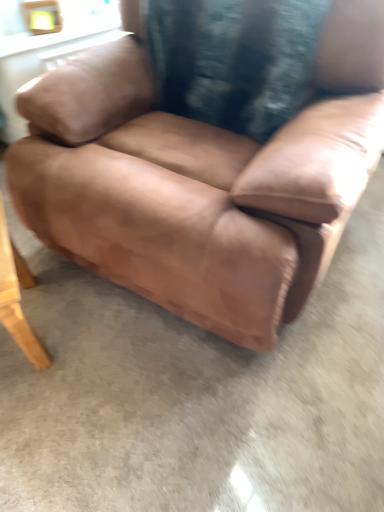
Identify the location of vacant area that is in front of wooden table at lower left. This screenshot has width=384, height=512. (49, 415).